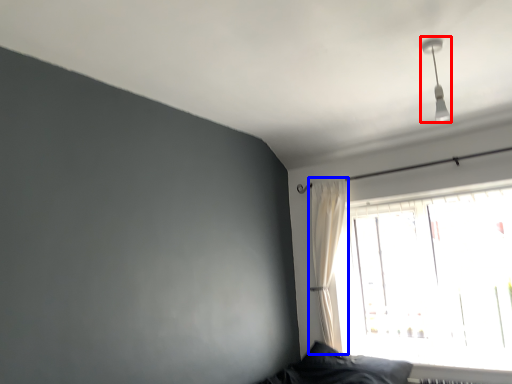
Question: Which of the following is the farthest to the observer, fixture (highlighted by a red box) or curtain (highlighted by a blue box)?

Choices:
 (A) fixture
 (B) curtain

Answer: (B)